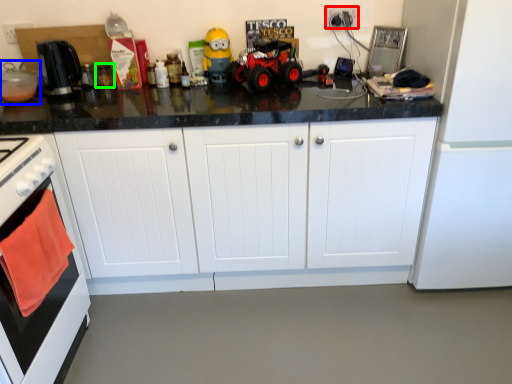
Question: Based on their relative distances, which object is farther from electric outlet (highlighted by a red box)? Choose from appliance (highlighted by a blue box) and appliance (highlighted by a green box).

Choices:
 (A) appliance
 (B) appliance

Answer: (A)